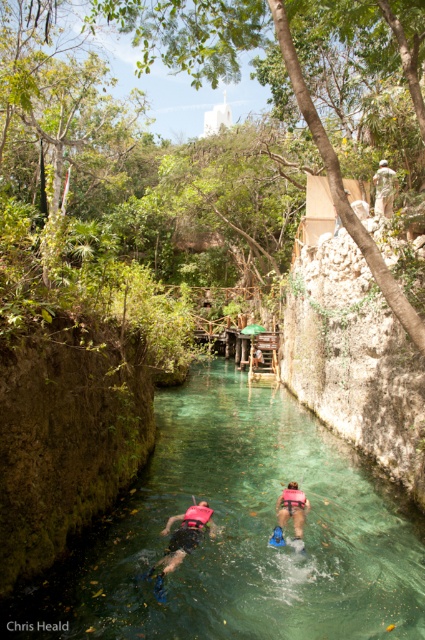
Question: Which point is farther from the camera taking this photo?

Choices:
 (A) (385, 186)
 (B) (195, 545)
 (C) (294, 538)

Answer: (A)

Question: Can you confirm if pink foam vest at lower center is thinner than pink fabric life jacket at lower center?

Choices:
 (A) yes
 (B) no

Answer: (B)

Question: Can you confirm if camouflage fabric person at upper center is smaller than pink fabric life jacket at lower center?

Choices:
 (A) no
 (B) yes

Answer: (B)

Question: Does camouflage fabric person at upper center appear on the left side of pink foam life jacket at lower center?

Choices:
 (A) no
 (B) yes

Answer: (A)

Question: Which of the following is the farthest from the observer?

Choices:
 (A) clear glassy water at center
 (B) pink foam vest at center
 (C) camouflage fabric person at upper center

Answer: (C)

Question: Which object is the closest to the clear glassy water at center?

Choices:
 (A) pink foam vest at lower center
 (B) pink fabric life jacket at lower center

Answer: (A)